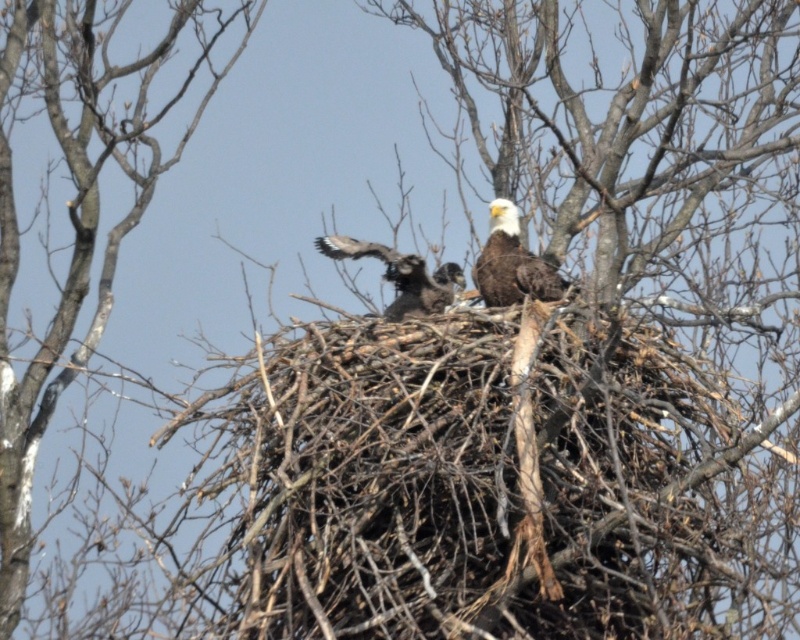
What are the coordinates of the white feathered eagle at center?

The white feathered eagle at center is located at point [512,262].

You are an ornithologist observing a tree with a bird nest. You notice a point in the image at coordinates (78, 218). What is located at this point?

The bare branches at center is located at point (78, 218).